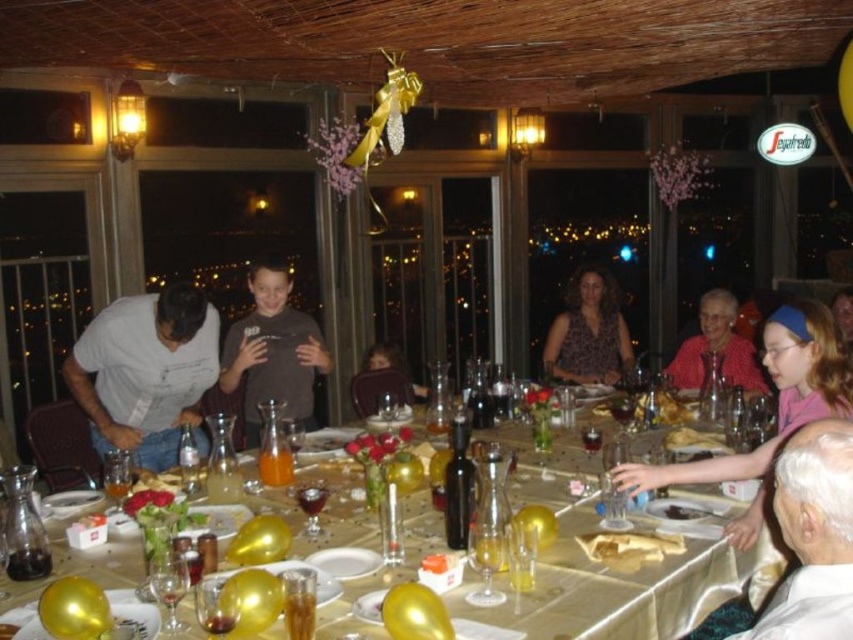
You are a server at the event and need to determine which wine glass is shorter. You see the translucent glass wine glass at lower center and the translucent glass wine glass at center. Which one is shorter?

The translucent glass wine glass at lower center is shorter than the translucent glass wine glass at center.

You are a server in this restaurant and need to deliver a dessert to the table. The dessert needs to be placed between the matte brown sweater at center and the translucent glass wine glass at center. How far apart are these two items?

The matte brown sweater at center is 5.95 feet away from the translucent glass wine glass at center, so the dessert can be placed between them with a distance of approximately 5.95 feet between the two items.